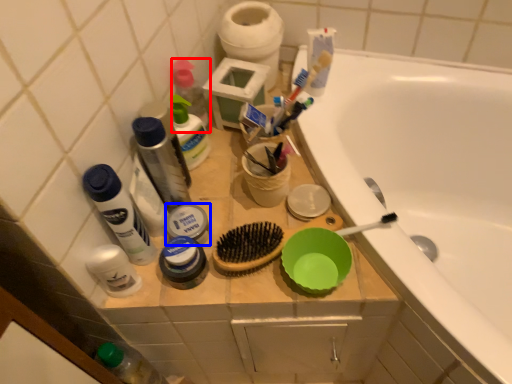
Question: Among these objects, which one is farthest to the camera, toiletry (highlighted by a red box) or toiletry (highlighted by a blue box)?

Choices:
 (A) toiletry
 (B) toiletry

Answer: (A)